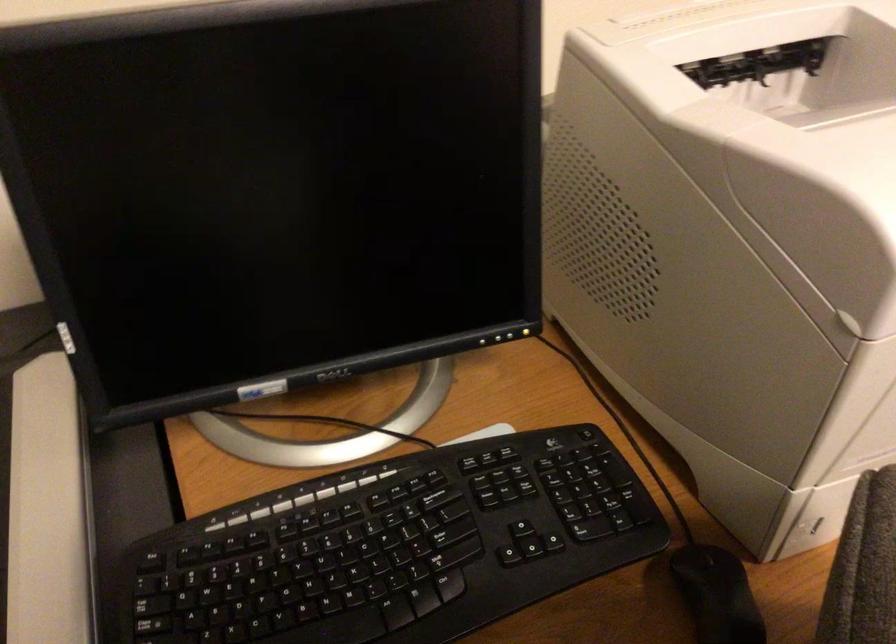
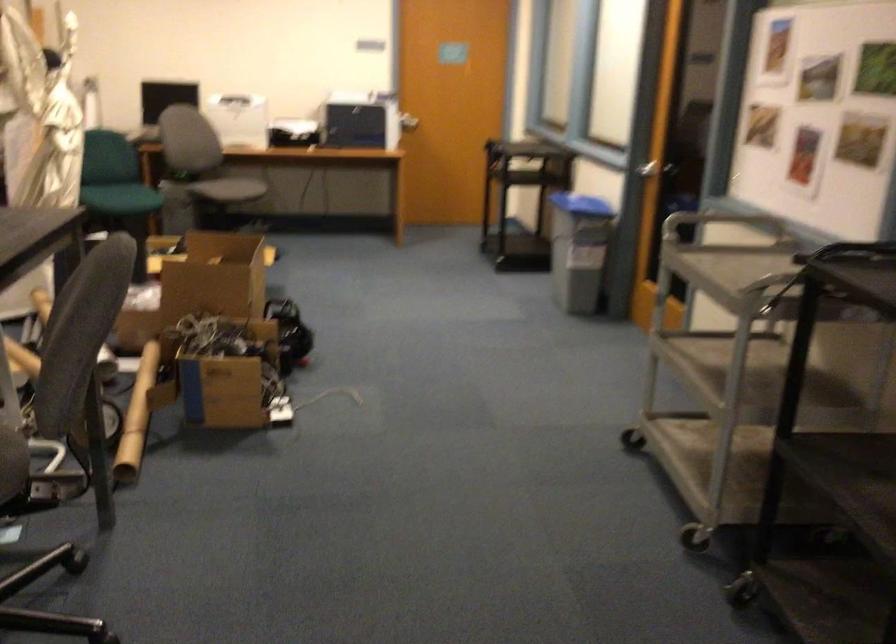
Question: I am providing you with two images of the same scene from different viewpoints. After the viewpoint changes to image2, which objects are now occluded?

Choices:
 (A) white pump bottle head
 (B) silver door handle
 (C) black keyboard key
 (D) cardboard box

Answer: (C)